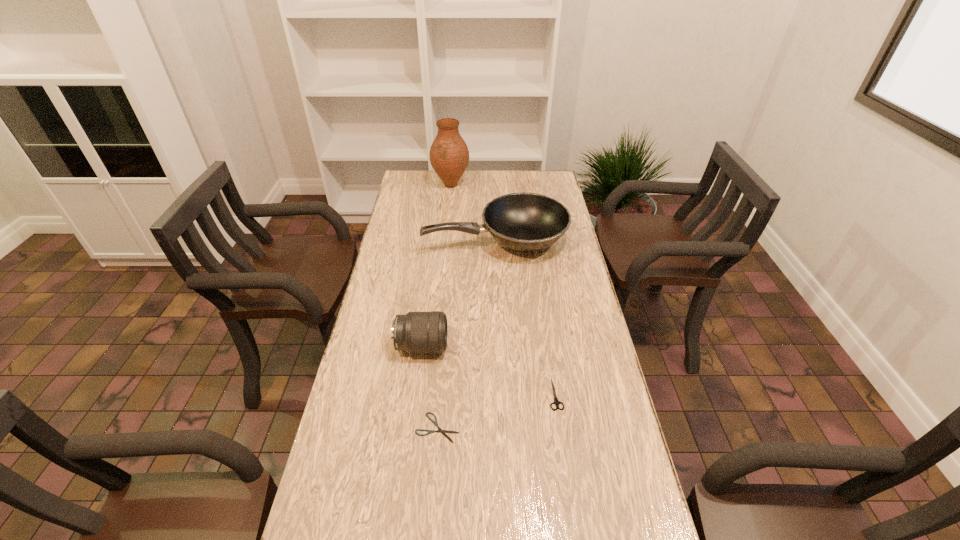
I want to click on vacant point at the far edge, so click(x=468, y=183).

Where is `free region at the left edge of the desktop`? free region at the left edge of the desktop is located at coordinates (386, 363).

Find the location of a particular element. free space at the right edge is located at coordinates pos(564,298).

Image resolution: width=960 pixels, height=540 pixels. In order to click on vacant region at the far left corner of the desktop in this screenshot , I will do `click(417, 195)`.

Where is `free space at the far right corner of the desktop`? The image size is (960, 540). free space at the far right corner of the desktop is located at coordinates (x=533, y=191).

Where is `vacant area between the nearer shears and the third farthest object`? vacant area between the nearer shears and the third farthest object is located at coordinates (430, 387).

This screenshot has height=540, width=960. Identify the location of vacant space that's between the shortest object and the third farthest object. (430, 387).

I want to click on vacant space in between the telephoto lens and the second farthest object, so click(459, 293).

Where is `free spot between the fourth tallest object and the nearest object`? free spot between the fourth tallest object and the nearest object is located at coordinates (496, 411).

Image resolution: width=960 pixels, height=540 pixels. Identify the location of free spot between the fourth nearest object and the nearest object. (467, 334).